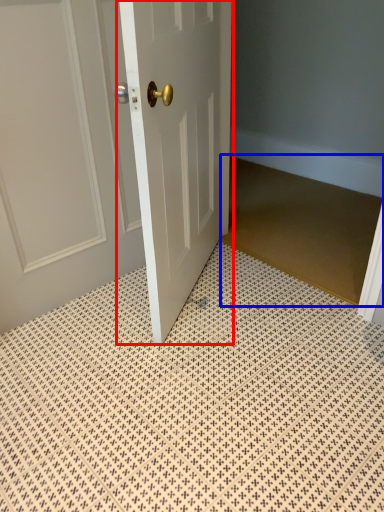
Question: Which object appears farthest to the camera in this image, door (highlighted by a red box) or doormat (highlighted by a blue box)?

Choices:
 (A) door
 (B) doormat

Answer: (B)